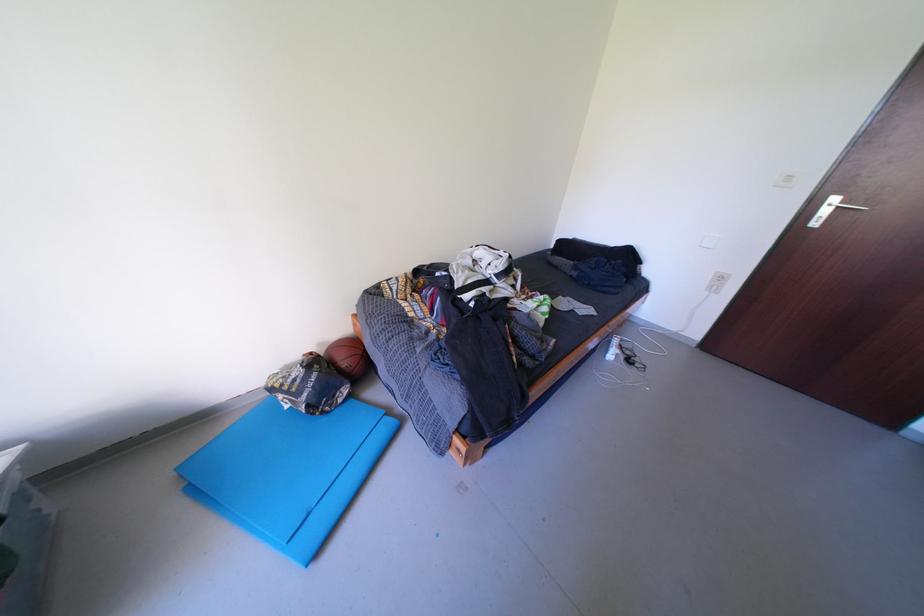
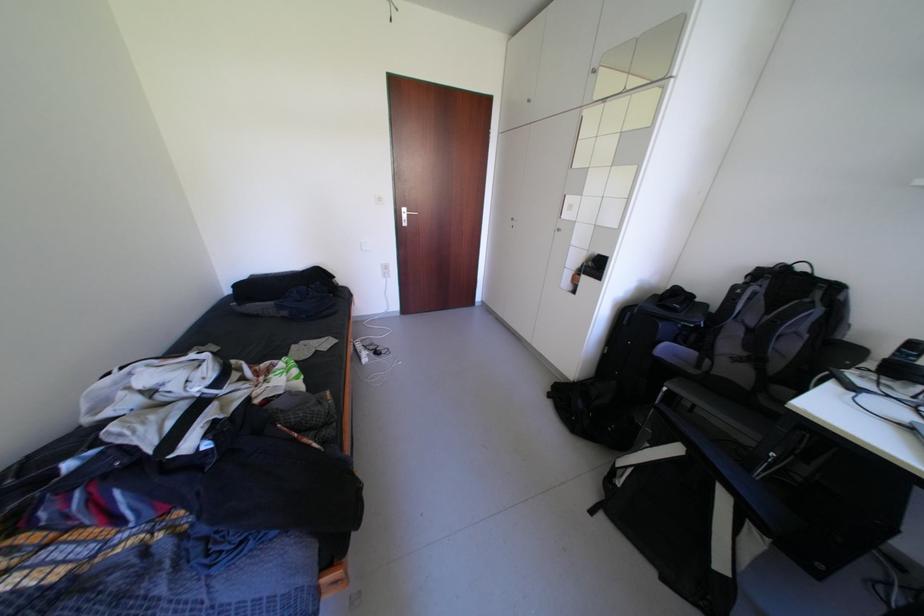
How did the camera likely rotate?

The rotation direction of the camera is right-down.